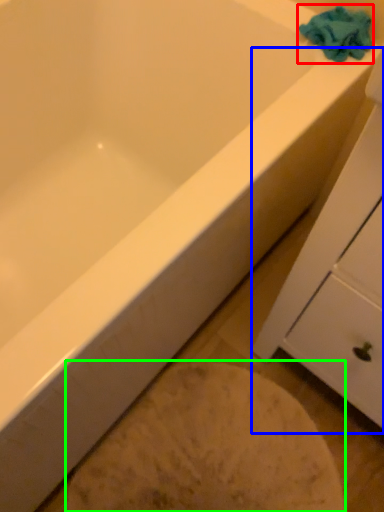
Question: Which is farther away from bath towel (highlighted by a red box)? cabinetry (highlighted by a blue box) or porcelain (highlighted by a green box)?

Choices:
 (A) cabinetry
 (B) porcelain

Answer: (B)